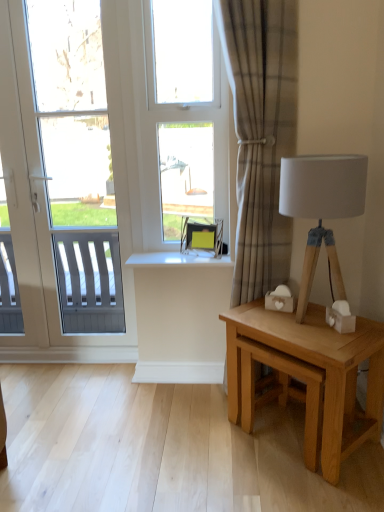
This screenshot has width=384, height=512. Find the location of `vacant point to the left of plaid fabric curtain at center`. vacant point to the left of plaid fabric curtain at center is located at coordinates (198, 400).